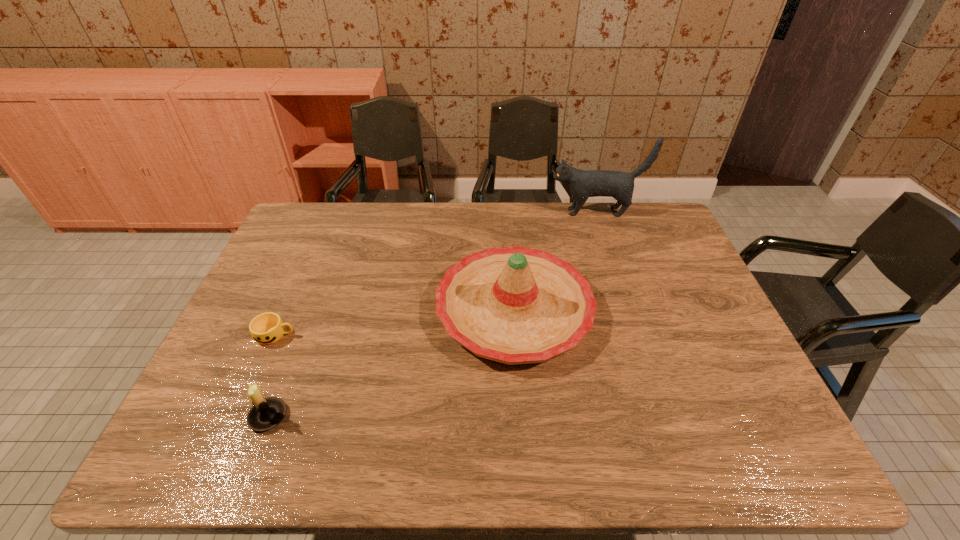
What are the coordinates of `vacant point at the near edge` in the screenshot? It's located at (368, 464).

Where is `vacant area at the left edge of the desktop`? This screenshot has height=540, width=960. vacant area at the left edge of the desktop is located at coordinates (305, 292).

This screenshot has width=960, height=540. I want to click on vacant region at the right edge of the desktop, so click(706, 296).

In order to click on vacant region at the far left corner of the desktop in this screenshot , I will do click(x=322, y=228).

Where is `vacant space at the near left corner of the desktop`? This screenshot has height=540, width=960. vacant space at the near left corner of the desktop is located at coordinates (197, 430).

The image size is (960, 540). I want to click on vacant space at the far right corner of the desktop, so click(634, 205).

Where is `free space that is in between the cup and the candle holder`? The image size is (960, 540). free space that is in between the cup and the candle holder is located at coordinates (272, 376).

This screenshot has height=540, width=960. In order to click on vacant area that lies between the sombrero and the shortest object in this screenshot , I will do `click(395, 322)`.

The image size is (960, 540). What are the coordinates of `vacant space that's between the tallest object and the shortest object` in the screenshot? It's located at (436, 274).

At what (x,y) coordinates should I click in order to perform the action: click on blank region between the shortest object and the candle holder. Please return your answer as a coordinate pair (x, y). Image resolution: width=960 pixels, height=540 pixels. Looking at the image, I should click on pyautogui.click(x=272, y=376).